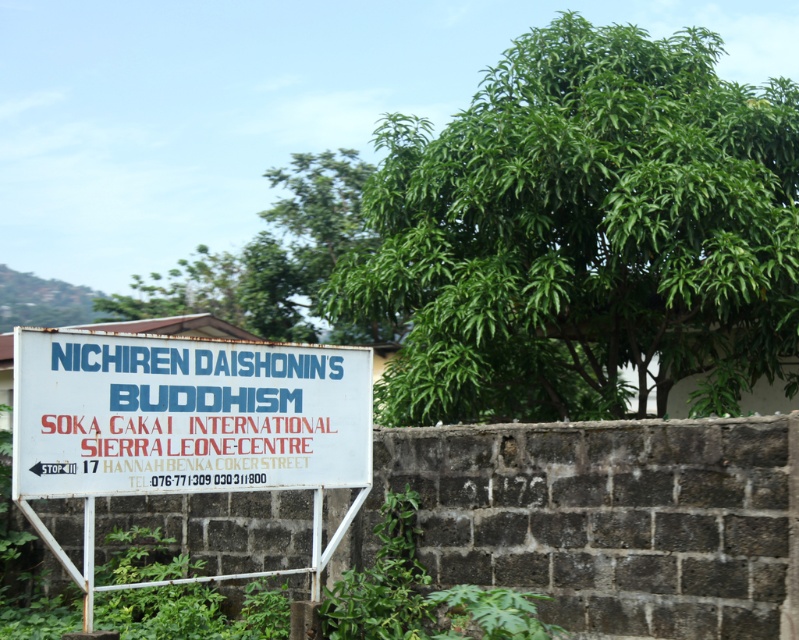
Is green leafy tree at upper right bigger than green leafy tree at upper center?

Indeed, green leafy tree at upper right has a larger size compared to green leafy tree at upper center.

In the scene shown: Does green leafy tree at upper right lie in front of green leafy tree at upper center?

Yes.

The height and width of the screenshot is (640, 799). In order to click on green leafy tree at upper right in this screenshot , I will do point(582,234).

Is white plastic sign at center wider than green leafy tree at upper center?

Yes.

Is white plastic sign at center positioned before green leafy tree at upper center?

Yes, it is in front of green leafy tree at upper center.

Who is more forward, (360, 385) or (285, 282)?

Point (360, 385) is in front.

Where is `white plastic sign at center`? white plastic sign at center is located at coordinates (185, 413).

Describe the element at coordinates (582, 234) in the screenshot. I see `green leafy tree at upper right` at that location.

Looking at this image, does green leafy tree at upper right have a smaller size compared to white plastic sign at center?

Actually, green leafy tree at upper right might be larger than white plastic sign at center.

Locate an element on the screen. The height and width of the screenshot is (640, 799). green leafy tree at upper right is located at coordinates (582, 234).